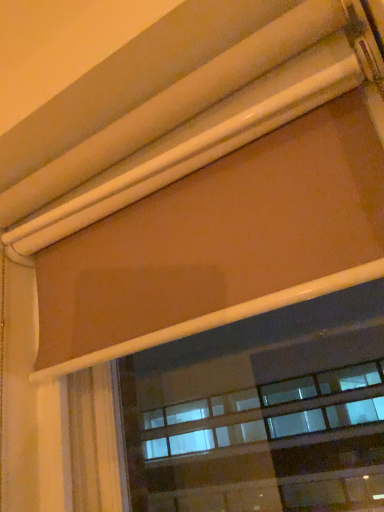
Question: Should I look upward or downward to see matte brown roller blind at upper center?

Choices:
 (A) up
 (B) down

Answer: (A)